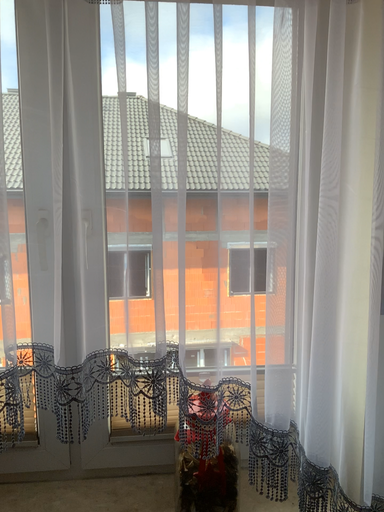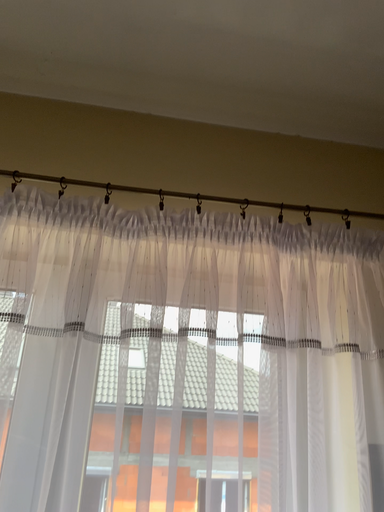
Question: Which way did the camera rotate in the video?

Choices:
 (A) rotated downward
 (B) rotated upward

Answer: (B)